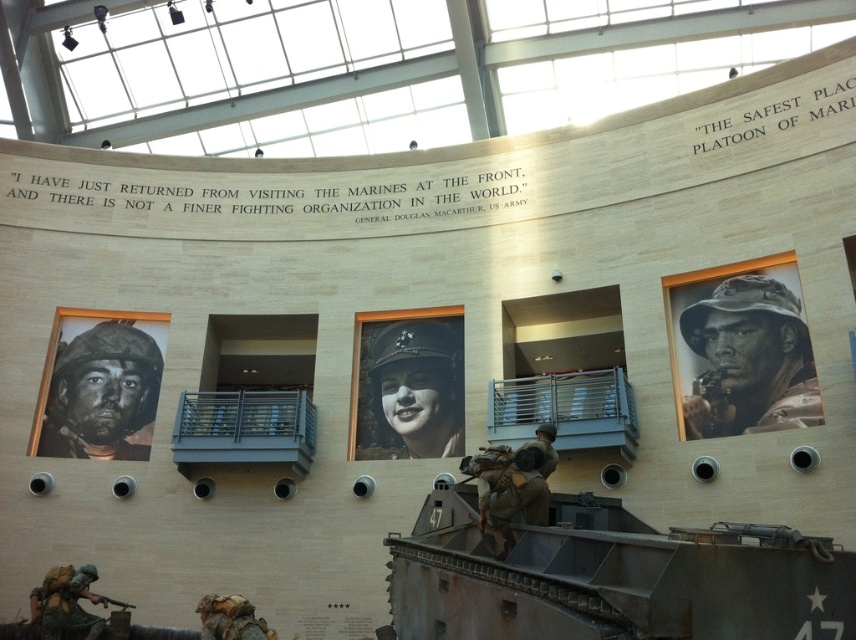
Question: Which object is closer to the camera taking this photo?

Choices:
 (A) matte bronze soldier at lower left
 (B) black matte helmet at left
 (C) green matte tank at center

Answer: (C)

Question: Which point is farther from the camera taking this photo?

Choices:
 (A) (51, 628)
 (B) (734, 595)
 (C) (376, 432)
 (D) (120, 387)

Answer: (D)

Question: Is green matte tank at center further to the viewer compared to black matte helmet at center?

Choices:
 (A) yes
 (B) no

Answer: (B)

Question: Among these objects, which one is nearest to the camera?

Choices:
 (A) black matte helmet at center
 (B) black matte helmet at right
 (C) matte bronze soldier at lower left

Answer: (C)

Question: Is black matte helmet at right above matte black rifle at lower left?

Choices:
 (A) yes
 (B) no

Answer: (A)

Question: Does black matte helmet at right have a smaller size compared to black matte helmet at left?

Choices:
 (A) no
 (B) yes

Answer: (A)